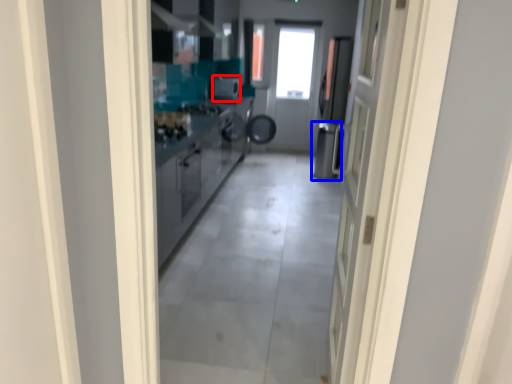
Question: Which object is closer to the camera taking this photo, appliance (highlighted by a red box) or dish washer (highlighted by a blue box)?

Choices:
 (A) appliance
 (B) dish washer

Answer: (B)